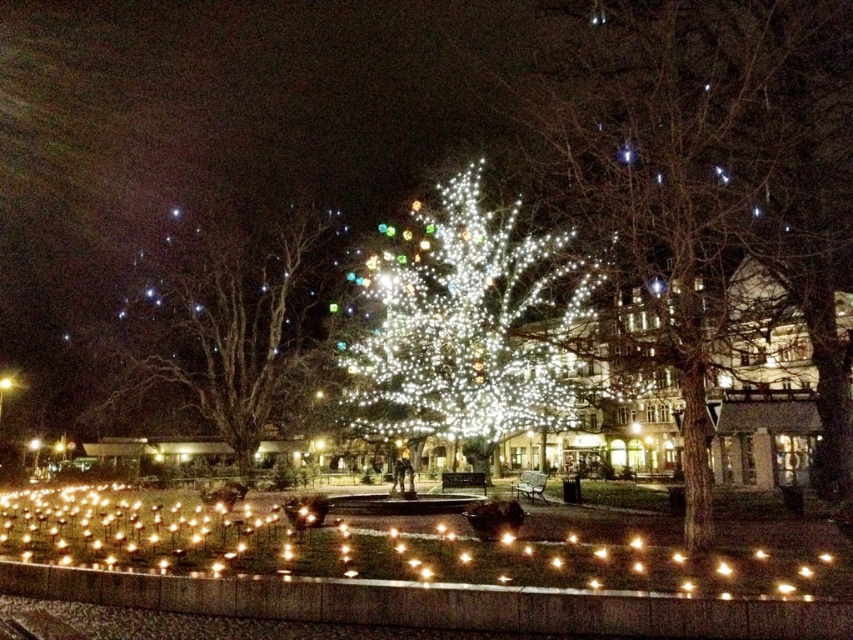
You are a GUI agent. You are given a task and a screenshot of the screen. Output one action in this format:
    pyautogui.click(x=<x>, y=<y>)
    Task: Click on the illuminated glass christmas tree at center
    Image resolution: width=853 pixels, height=640 pixels.
    Given the screenshot: What is the action you would take?
    pyautogui.click(x=466, y=330)

Describe the element at coordinates (466, 330) in the screenshot. The width and height of the screenshot is (853, 640). I see `illuminated glass christmas tree at center` at that location.

The height and width of the screenshot is (640, 853). What do you see at coordinates (466, 330) in the screenshot?
I see `illuminated glass christmas tree at center` at bounding box center [466, 330].

Locate an element on the screen. This screenshot has height=640, width=853. illuminated glass christmas tree at center is located at coordinates (466, 330).

Which is behind, point (705, 84) or point (219, 301)?

The point (219, 301) is behind.

Does illuminated white lights at center lie in front of illuminated wireframe tree at left?

Yes, it is.

Between point (654, 204) and point (296, 280), which one is positioned behind?

The point (296, 280) is behind.

Where is `illuminated white lights at center`? The width and height of the screenshot is (853, 640). illuminated white lights at center is located at coordinates [x=709, y=170].

Consider the image. Is illuminated white lights at center closer to camera compared to illuminated glass christmas tree at center?

Yes, illuminated white lights at center is in front of illuminated glass christmas tree at center.

In the scene shown: Does illuminated white lights at center have a lesser width compared to illuminated glass christmas tree at center?

No.

Does point (837, 349) come in front of point (442, 296)?

That is True.

Locate an element on the screen. This screenshot has height=640, width=853. illuminated white lights at center is located at coordinates (709, 170).